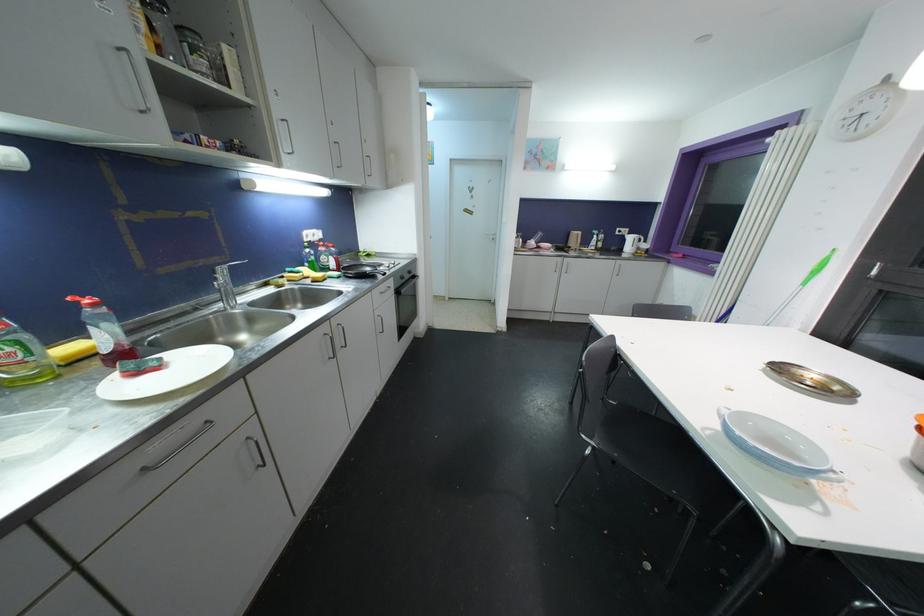
This screenshot has width=924, height=616. What do you see at coordinates (642, 447) in the screenshot?
I see `a chair sitting surface` at bounding box center [642, 447].